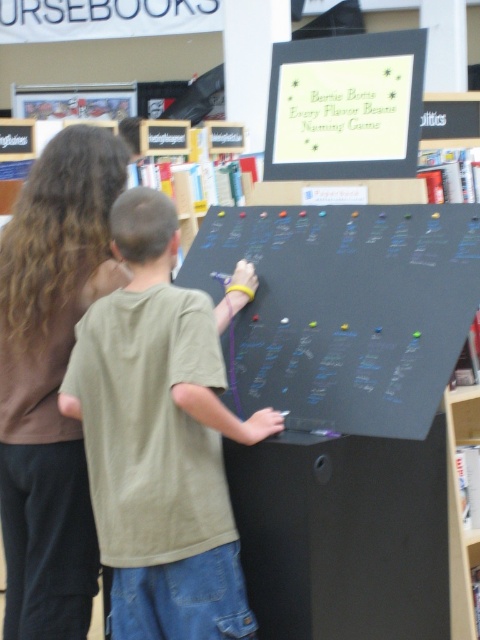
You are a photographer standing in the library scene. You want to take a photo that includes both the green cotton shirt at center and the black chalkboard at center. Which object should you position closer to the camera to ensure both are in focus?

The green cotton shirt at center is taller than the black chalkboard at center. To ensure both are in focus, position the green cotton shirt at center closer to the camera since it is taller and requires more focus adjustment.

You are a visitor in this library and want to hang a small poster on the wall between the black chalkboard at center and the matte black board at upper center. Which object should you place the poster closer to if you want it to be at a lower position?

You should place the poster closer to the black chalkboard at center because it is taller than the matte black board at upper center, so positioning it near the lower chalkboard would keep the poster at a lower height.